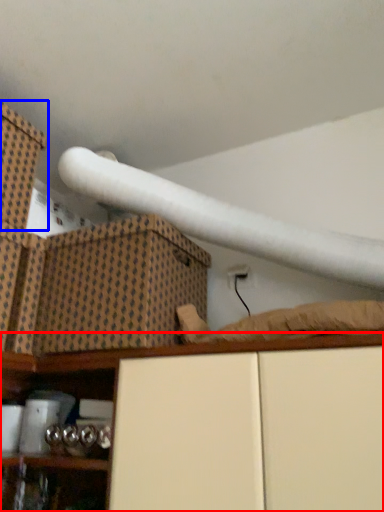
Question: Which point is closer to the camera, shelf (highlighted by a red box) or box (highlighted by a blue box)?

Choices:
 (A) shelf
 (B) box

Answer: (A)